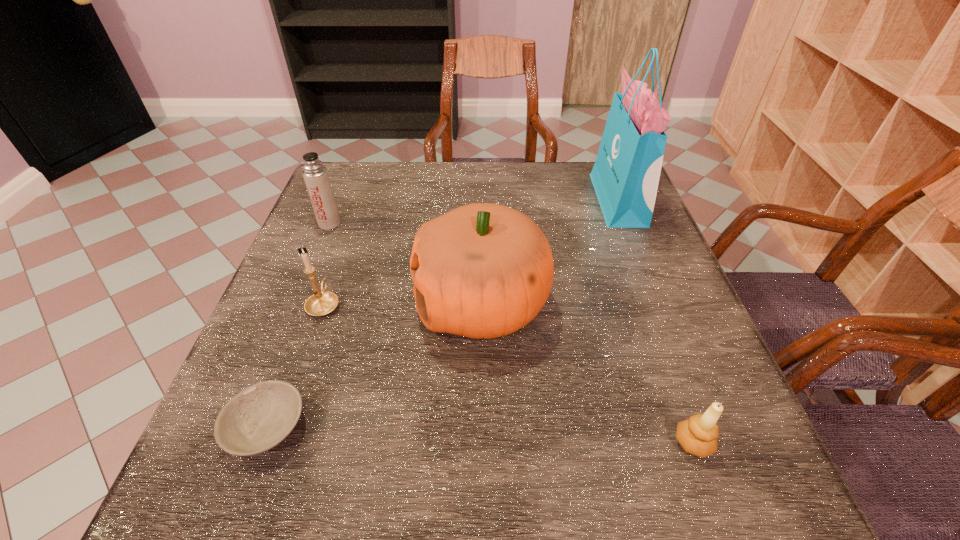
This screenshot has height=540, width=960. I want to click on candle_holder situated at the near edge, so (x=698, y=435).

The image size is (960, 540). I want to click on bowl that is at the near edge, so click(257, 419).

The width and height of the screenshot is (960, 540). Identify the location of thermos bottle that is positioned at the left edge. (315, 174).

Find the location of a particular element. The width and height of the screenshot is (960, 540). candle holder that is at the left edge is located at coordinates (323, 302).

The width and height of the screenshot is (960, 540). What are the coordinates of `bowl that is at the left edge` in the screenshot? It's located at (257, 419).

Find the location of `shopping bag located in the right edge section of the desktop`. shopping bag located in the right edge section of the desktop is located at coordinates (625, 176).

You are a GUI agent. You are given a task and a screenshot of the screen. Output one action in this format:
    pyautogui.click(x=<x>, y=<y>)
    Task: Click on the candle_holder that is positioned at the right edge
    The image size is (960, 540).
    Given the screenshot: What is the action you would take?
    pyautogui.click(x=698, y=435)

The image size is (960, 540). What are the coordinates of `object that is at the near left corner` in the screenshot? It's located at (257, 419).

Locate an element on the screen. This screenshot has width=960, height=540. object that is at the far right corner is located at coordinates (625, 176).

Identify the location of object present at the near right corner. (698, 435).